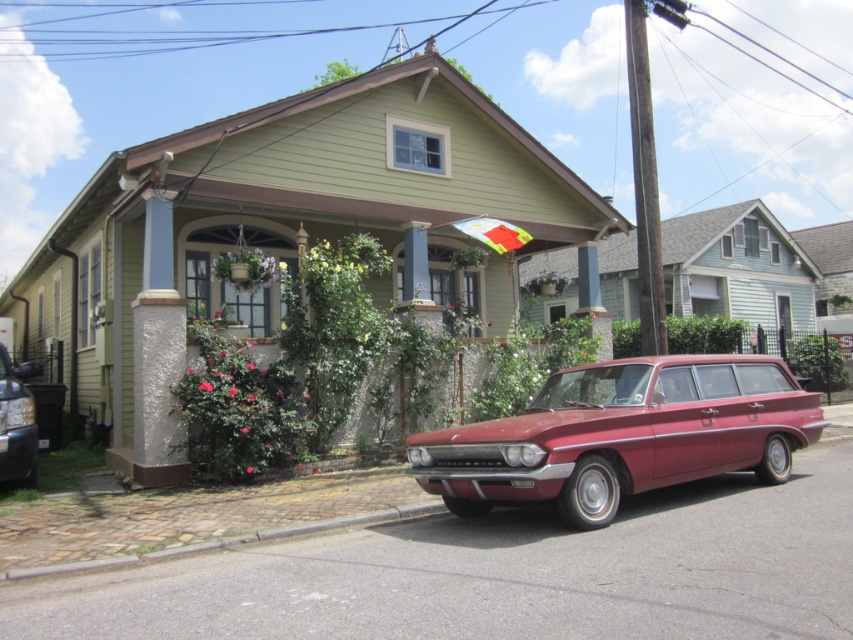
From the picture: Does glossy red station wagon at center have a greater height compared to shiny black sedan at left?

Yes.

Find the location of a particular element. glossy red station wagon at center is located at coordinates (624, 435).

Find the location of `glossy red station wagon at center`. glossy red station wagon at center is located at coordinates (624, 435).